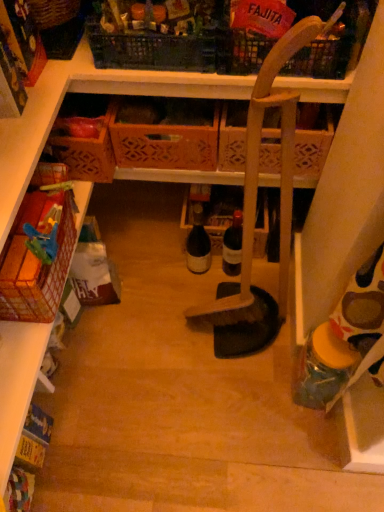
The width and height of the screenshot is (384, 512). Find the location of `vacant space underneath wooden crate at center, the fourth basket positioned from the top (from a real-world perspective)`. vacant space underneath wooden crate at center, the fourth basket positioned from the top (from a real-world perspective) is located at coordinates (168, 212).